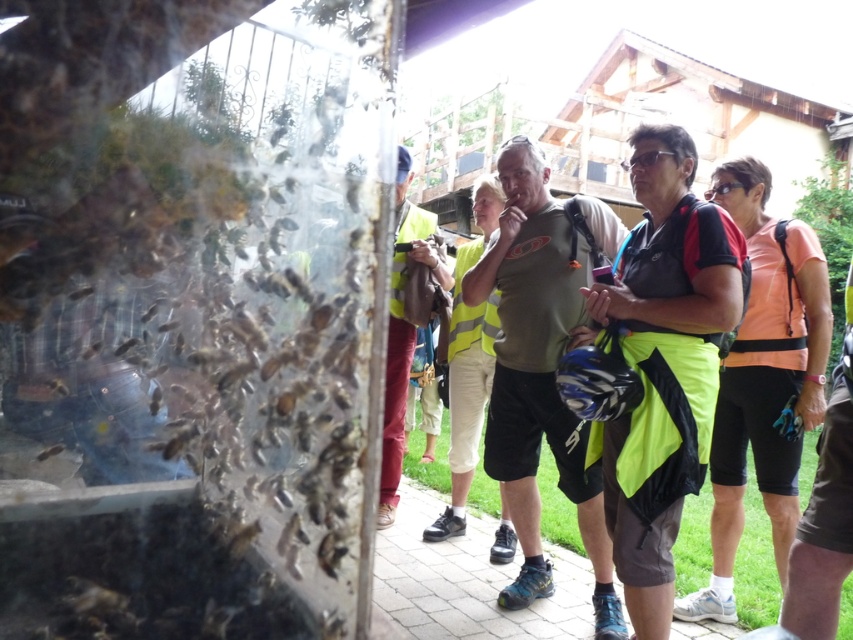
You are a photographer trying to capture a clear image of the black matte shorts at center and the black matte sunglasses at center through the foggy glass. Which object will be easier to focus on due to its size?

The black matte shorts at center is larger in size than the black matte sunglasses at center, so it will be easier to focus on the black matte shorts at center because larger objects are generally easier to capture clearly through foggy surfaces.